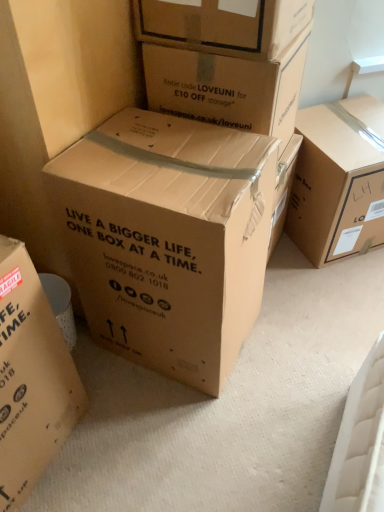
Identify the location of free space in front of brown cardboard box at center, the fourth box viewed from the right. (180, 436).